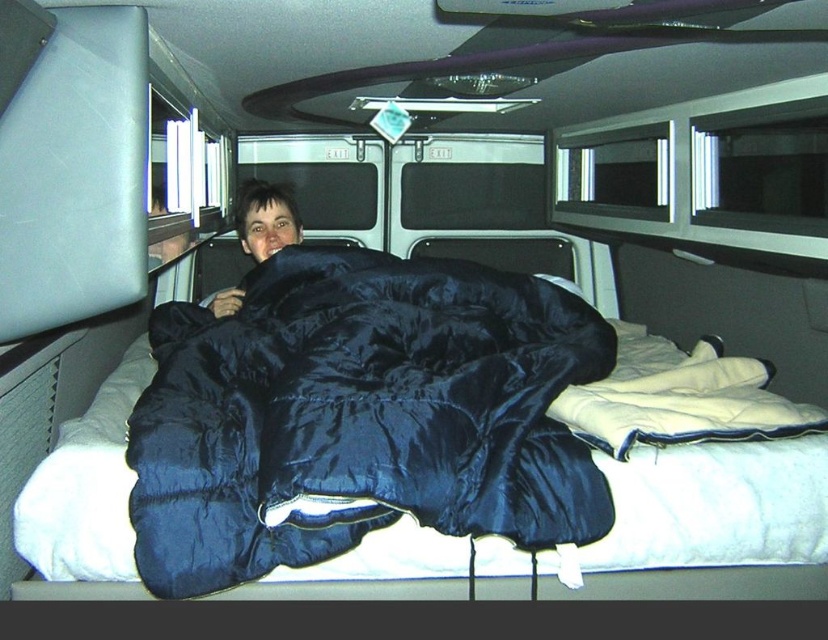
You are a traveler who needs to choose between the black silky sleeping bag at center and the matte black sleeping bag at center for a cold night. Which one would you recommend based on their material and the scene?

The black silky sleeping bag at center is made of silk, which is warmer than the matte black sleeping bag at center. Choose the black silky sleeping bag at center for a cold night.

You are inside the overnight travel vehicle and want to place a small lamp between the two points labeled as point (229, 470) and point (242, 212). Which point should the lamp be closer to if you want it nearer to the camera?

The lamp should be placed closer to point (229, 470) because it is closer to the camera than point (242, 212).